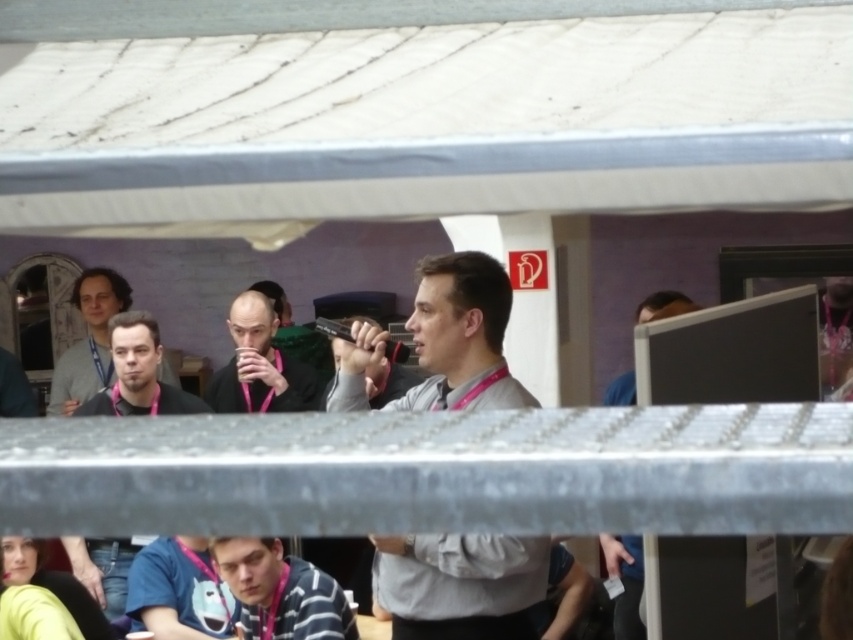
The width and height of the screenshot is (853, 640). Find the location of `blue matte t-shirt at lower center`. blue matte t-shirt at lower center is located at coordinates (178, 592).

Who is more distant from viewer, (173, 602) or (619, 547)?

The point (619, 547) is more distant.

What are the coordinates of `blue matte t-shirt at lower center` in the screenshot? It's located at (178, 592).

You are a GUI agent. You are given a task and a screenshot of the screen. Output one action in this format:
    pyautogui.click(x=<x>, y=<y>)
    Task: Click on the matte black mug at center
    This screenshot has height=640, width=853.
    Given the screenshot: What is the action you would take?
    pyautogui.click(x=260, y=365)

What do you see at coordinates (260, 365) in the screenshot? The height and width of the screenshot is (640, 853). I see `matte black mug at center` at bounding box center [260, 365].

Which is behind, point (265, 324) or point (646, 317)?

Positioned behind is point (646, 317).

You are a GUI agent. You are given a task and a screenshot of the screen. Output one action in this format:
    pyautogui.click(x=<x>, y=<y>)
    Task: Click on the matte black mug at center
    
    Given the screenshot: What is the action you would take?
    pyautogui.click(x=260, y=365)

Between gray fabric shirt at center and blue fabric shirt at right, which one appears on the left side from the viewer's perspective?

gray fabric shirt at center

Consider the image. Can you confirm if gray fabric shirt at center is thinner than blue fabric shirt at right?

No.

What do you see at coordinates (460, 584) in the screenshot? The height and width of the screenshot is (640, 853). I see `gray fabric shirt at center` at bounding box center [460, 584].

At what (x,y) coordinates should I click in order to perform the action: click on gray fabric shirt at center. Please return your answer as a coordinate pair (x, y). Looking at the image, I should click on (460, 584).